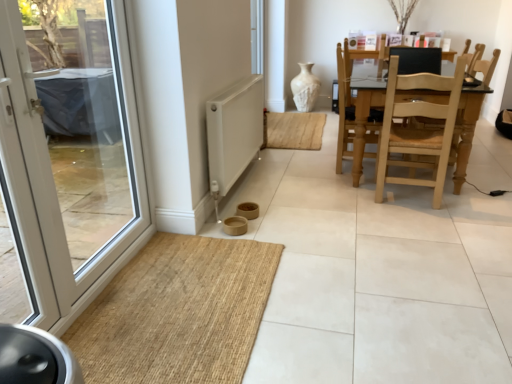
Identify the location of vacant area in front of white matte radiator at lower center. Image resolution: width=512 pixels, height=384 pixels. (269, 232).